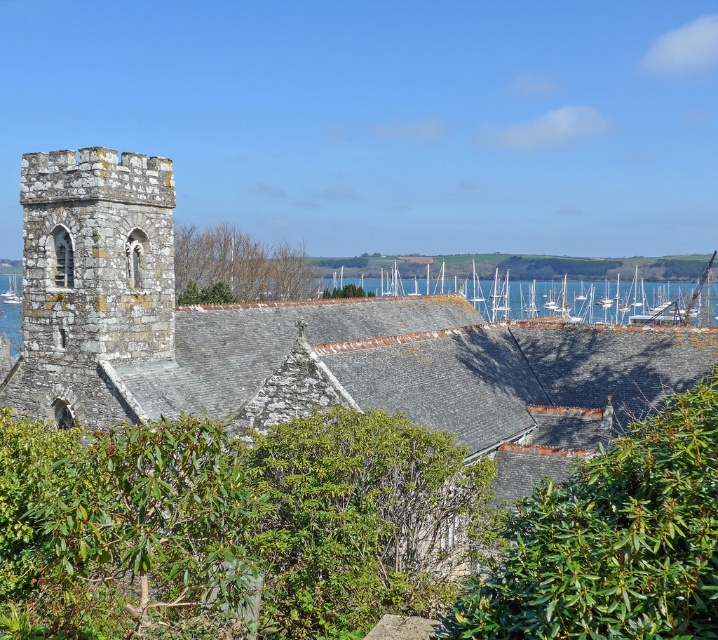
Question: Based on their relative distances, which object is nearer to the white wooden boats at center?

Choices:
 (A) bare branches at upper center
 (B) green leafy bush at center

Answer: (A)

Question: Is stone church at left further to the viewer compared to green leafy bush at center?

Choices:
 (A) no
 (B) yes

Answer: (B)

Question: Which object is closer to the camera taking this photo?

Choices:
 (A) stone tower at left
 (B) white wooden boats at center

Answer: (A)

Question: Does stone tower at left have a greater width compared to bare branches at upper center?

Choices:
 (A) no
 (B) yes

Answer: (A)

Question: Which point is closer to the camera taking this photo?

Choices:
 (A) (238, 250)
 (B) (559, 486)
 (C) (129, 236)
 (D) (391, 387)

Answer: (B)

Question: Is stone church at left bigger than white wooden boats at center?

Choices:
 (A) yes
 (B) no

Answer: (B)